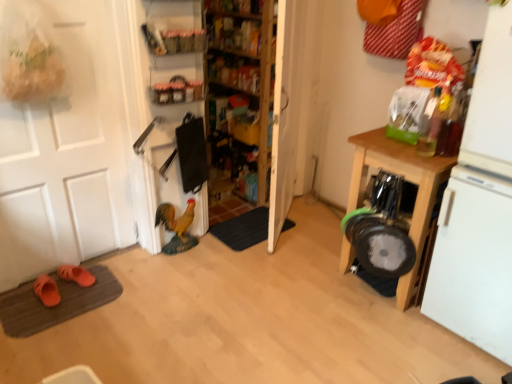
Identify the location of empty space that is ontop of brown textured doormat at lower left, which is the 1th doormat from left to right (from a real-world perspective). The height and width of the screenshot is (384, 512). (59, 303).